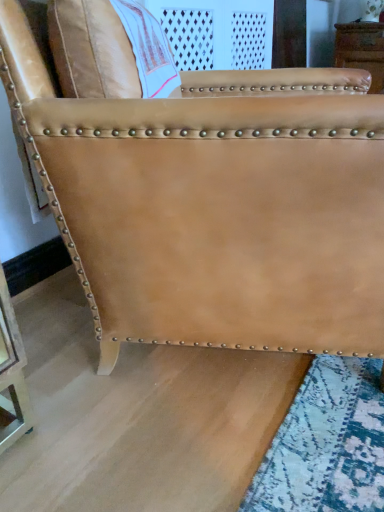
This screenshot has height=512, width=384. What do you see at coordinates (215, 204) in the screenshot?
I see `tan leather chair at center` at bounding box center [215, 204].

The width and height of the screenshot is (384, 512). I want to click on tan leather chair at center, so click(x=215, y=204).

This screenshot has width=384, height=512. What are the coordinates of `tan leather chair at upper right` in the screenshot? It's located at (361, 50).

Image resolution: width=384 pixels, height=512 pixels. Describe the element at coordinates (361, 50) in the screenshot. I see `tan leather chair at upper right` at that location.

The height and width of the screenshot is (512, 384). Identify the location of tan leather chair at center. (215, 204).

Is tan leather chair at upper right to the left of tan leather chair at center from the viewer's perspective?

No.

Is tan leather chair at upper right in front of or behind tan leather chair at center in the image?

Visually, tan leather chair at upper right is located behind tan leather chair at center.

Is point (344, 23) farther from viewer compared to point (147, 177)?

That is True.

Consider the image. From the image's perspective, between tan leather chair at upper right and tan leather chair at center, which one is located above?

From the image's view, tan leather chair at upper right is above.

From a real-world perspective, between tan leather chair at upper right and tan leather chair at center, who is vertically lower?

tan leather chair at center, from a real-world perspective.

Can you confirm if tan leather chair at upper right is thinner than tan leather chair at center?

Correct, the width of tan leather chair at upper right is less than that of tan leather chair at center.

Is tan leather chair at upper right taller or shorter than tan leather chair at center?

Clearly, tan leather chair at upper right is shorter compared to tan leather chair at center.

Which of these two, tan leather chair at upper right or tan leather chair at center, is bigger?

With larger size is tan leather chair at center.

Choose the correct answer: Is tan leather chair at upper right inside tan leather chair at center or outside it?

tan leather chair at upper right lies outside tan leather chair at center.

Is tan leather chair at upper right far away from tan leather chair at center?

Yes.

Is tan leather chair at upper right oriented away from tan leather chair at center?

Absolutely, tan leather chair at upper right is directed away from tan leather chair at center.

Can you tell me how much tan leather chair at upper right and tan leather chair at center differ in facing direction?

Answer: There is a 62.1-degree angle between the facing directions of tan leather chair at upper right and tan leather chair at center.

There is a tan leather chair at center. Where is `furniture above it (from a real-world perspective)`? The image size is (384, 512). furniture above it (from a real-world perspective) is located at coordinates (361, 50).

Considering the positions of objects tan leather chair at center and tan leather chair at upper right in the image provided, who is more to the left, tan leather chair at center or tan leather chair at upper right?

tan leather chair at center is more to the left.

Is the position of tan leather chair at center more distant than that of tan leather chair at upper right?

No, the depth of tan leather chair at center is less than that of tan leather chair at upper right.

Which is behind, point (21, 9) or point (362, 39)?

The point (362, 39) is more distant.

From the image's perspective, is tan leather chair at center beneath tan leather chair at upper right?

Correct, tan leather chair at center appears lower than tan leather chair at upper right in the image.

From a real-world perspective, relative to tan leather chair at upper right, is tan leather chair at center vertically above or below?

From a real-world perspective, tan leather chair at center is physically below tan leather chair at upper right.

Considering the sizes of tan leather chair at center and tan leather chair at upper right in the image, is tan leather chair at center wider or thinner than tan leather chair at upper right?

tan leather chair at center is wider than tan leather chair at upper right.

Consider the image. Which of these two, tan leather chair at center or tan leather chair at upper right, stands taller?

tan leather chair at center is taller.

Considering the relative sizes of tan leather chair at center and tan leather chair at upper right in the image provided, is tan leather chair at center smaller than tan leather chair at upper right?

Incorrect, tan leather chair at center is not smaller in size than tan leather chair at upper right.

Can tan leather chair at upper right be found inside tan leather chair at center?

No.

Is there a large distance between tan leather chair at center and tan leather chair at upper right?

Yes, tan leather chair at center and tan leather chair at upper right are quite far apart.

Is tan leather chair at center facing away from tan leather chair at upper right?

tan leather chair at center is not turned away from tan leather chair at upper right.

How different are the orientations of tan leather chair at center and tan leather chair at upper right in degrees?

They differ by 62.1 degrees in their facing directions.

At what (x,y) coordinates should I click in order to perform the action: click on chair on the left of the tan leather chair at upper right. Please return your answer as a coordinate pair (x, y). This screenshot has width=384, height=512. Looking at the image, I should click on (215, 204).

Locate an element on the screen. chair in front of the tan leather chair at upper right is located at coordinates (215, 204).

Find the location of a particular element. The image size is (384, 512). furniture that is behind the tan leather chair at center is located at coordinates (361, 50).